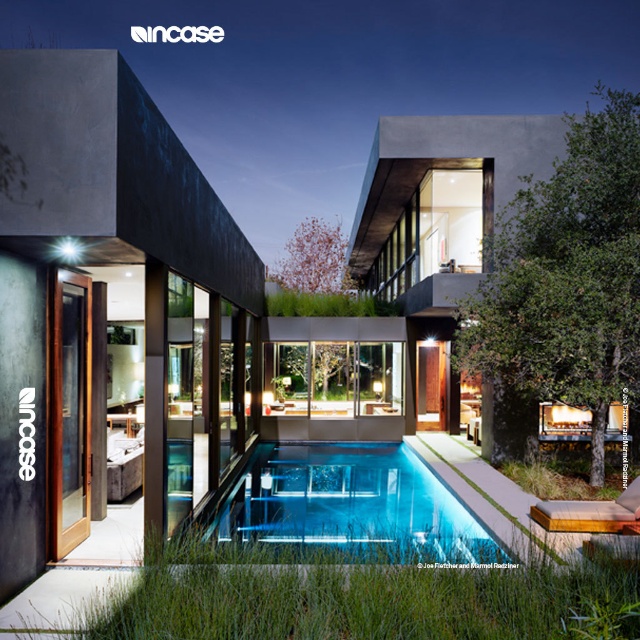
Question: Observing the image, what is the correct spatial positioning of blue glass pool at center in reference to transparent wood glass door at left?

Choices:
 (A) left
 (B) right

Answer: (B)

Question: Which of the following is the farthest from the observer?

Choices:
 (A) (58, 481)
 (B) (365, 536)

Answer: (B)

Question: Is blue glass pool at center below transparent wood glass door at left?

Choices:
 (A) yes
 (B) no

Answer: (A)

Question: Can you confirm if blue glass pool at center is positioned above transparent wood glass door at left?

Choices:
 (A) no
 (B) yes

Answer: (A)

Question: Among these objects, which one is nearest to the camera?

Choices:
 (A) blue glass pool at center
 (B) transparent wood glass door at left

Answer: (A)

Question: Which point is farther to the camera?

Choices:
 (A) coord(221,512)
 (B) coord(88,392)

Answer: (A)